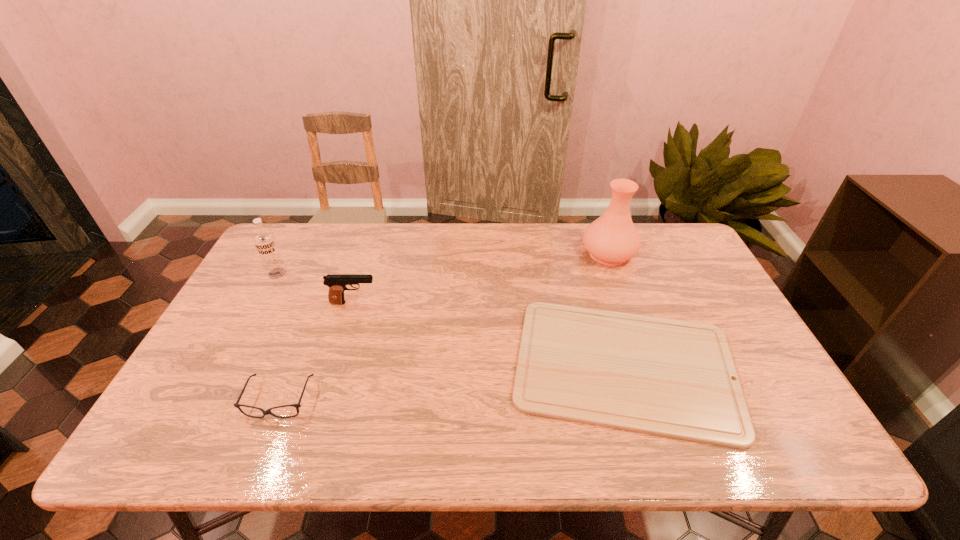
The width and height of the screenshot is (960, 540). I want to click on vacant space at the right edge of the desktop, so click(756, 363).

Find the location of a particular element. This screenshot has width=960, height=540. vacant region at the near right corner of the desktop is located at coordinates (756, 448).

This screenshot has width=960, height=540. What are the coordinates of `unoccupied position between the fourth shortest object and the pistol` in the screenshot? It's located at (316, 288).

Find the location of a particular element. The height and width of the screenshot is (540, 960). vacant region between the vase and the second shortest object is located at coordinates (444, 327).

The image size is (960, 540). Identify the location of vacant space in between the pistol and the tallest object. (481, 278).

Locate an element on the screen. vacant space that's between the vase and the third tallest object is located at coordinates (481, 278).

Image resolution: width=960 pixels, height=540 pixels. What are the coordinates of `free space between the leftmost object and the shortest object` in the screenshot? It's located at (451, 320).

Locate an element on the screen. The width and height of the screenshot is (960, 540). free area in between the vase and the fourth shortest object is located at coordinates (443, 264).

This screenshot has width=960, height=540. What are the coordinates of `vacant space that's between the vase and the spectacles` in the screenshot? It's located at (444, 327).

Where is `vacant point located between the second tallest object and the spectacles`? vacant point located between the second tallest object and the spectacles is located at coordinates (278, 336).